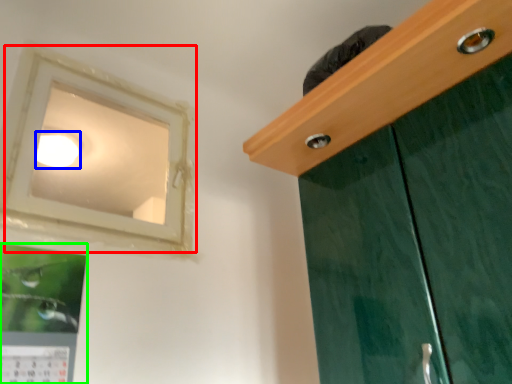
Question: Which is farther away from window (highlighted by a red box)? lighting (highlighted by a blue box) or picture frame (highlighted by a green box)?

Choices:
 (A) lighting
 (B) picture frame

Answer: (B)